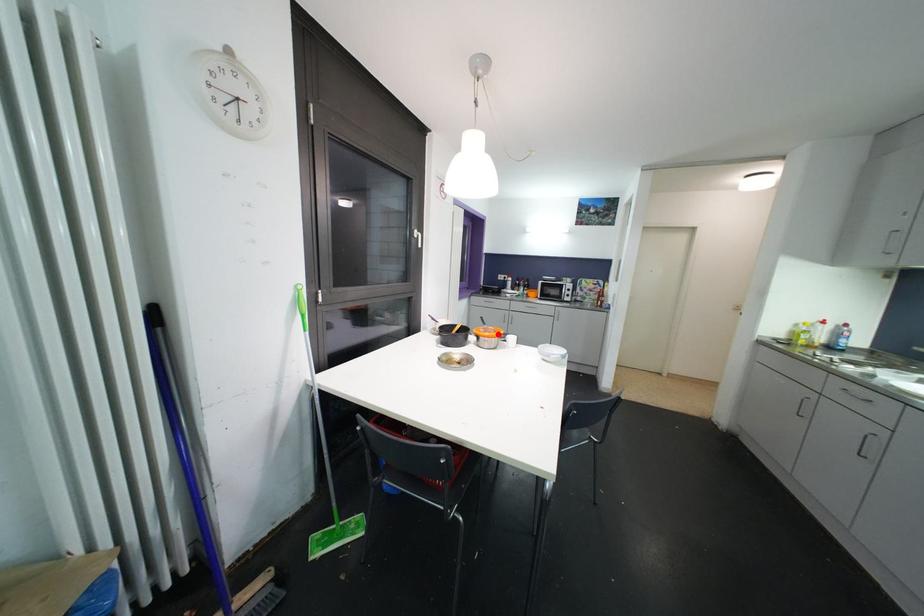
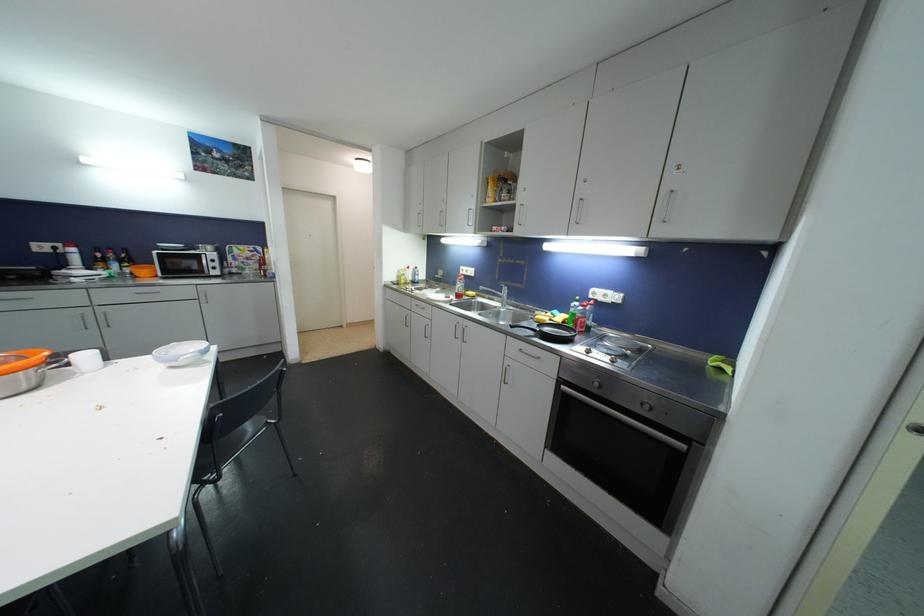
Where in the second image is the point corresponding to the highlighted location from the first image?

(25, 361)